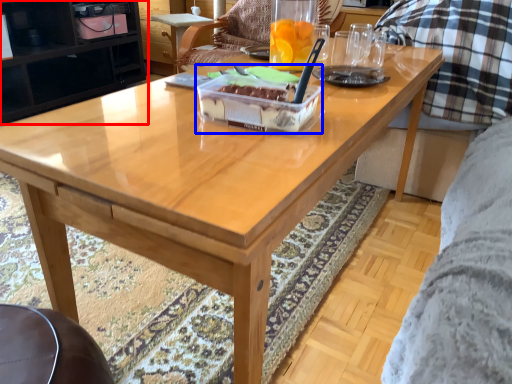
Question: Among these objects, which one is nearest to the camera, cabinetry (highlighted by a red box) or cake (highlighted by a blue box)?

Choices:
 (A) cabinetry
 (B) cake

Answer: (B)